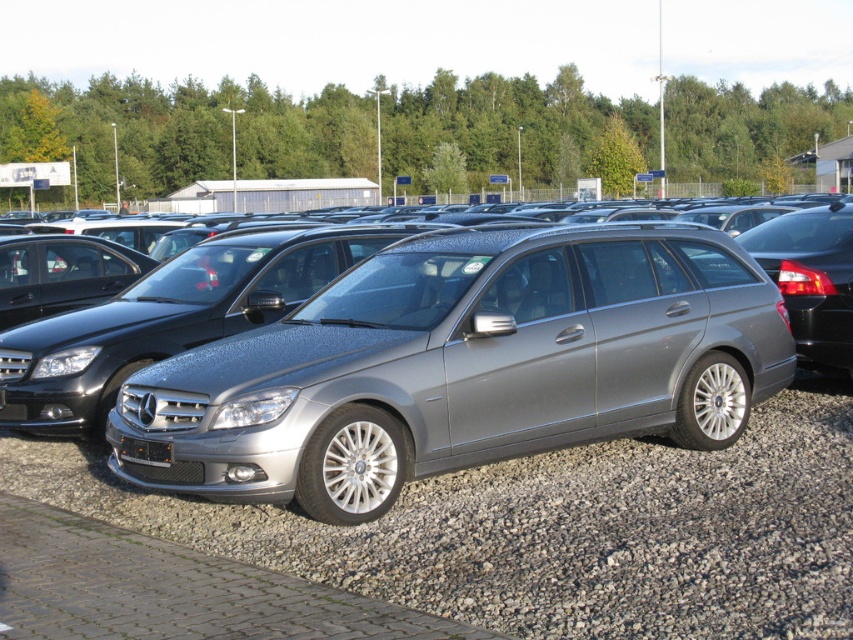
Is the position of satin metallic station wagon at center less distant than that of gray gravel at center?

No, satin metallic station wagon at center is behind gray gravel at center.

Is satin metallic station wagon at center wider than gray gravel at center?

Yes, satin metallic station wagon at center is wider than gray gravel at center.

Is point (296, 404) farther from viewer compared to point (96, 484)?

No, (296, 404) is in front of (96, 484).

This screenshot has height=640, width=853. I want to click on satin metallic station wagon at center, so click(463, 365).